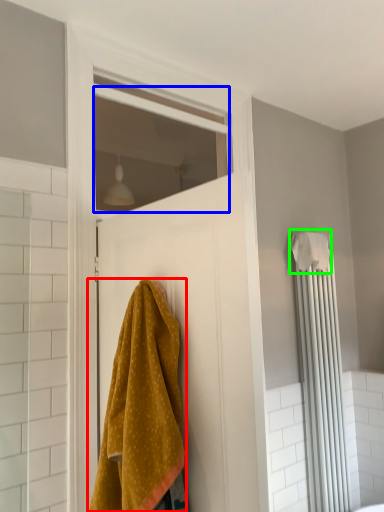
Question: Estimate the real-world distances between objects in this image. Which object is farther from towel (highlighted by a red box), window (highlighted by a blue box) or bath towel (highlighted by a green box)?

Choices:
 (A) window
 (B) bath towel

Answer: (A)